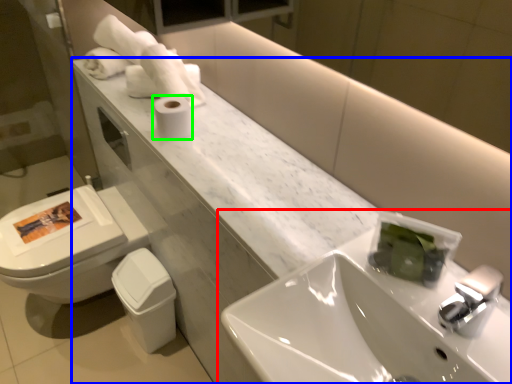
Question: Which object is the farthest from sink (highlighted by a red box)? Choose among these: counter (highlighted by a blue box) or toilet paper (highlighted by a green box).

Choices:
 (A) counter
 (B) toilet paper

Answer: (B)